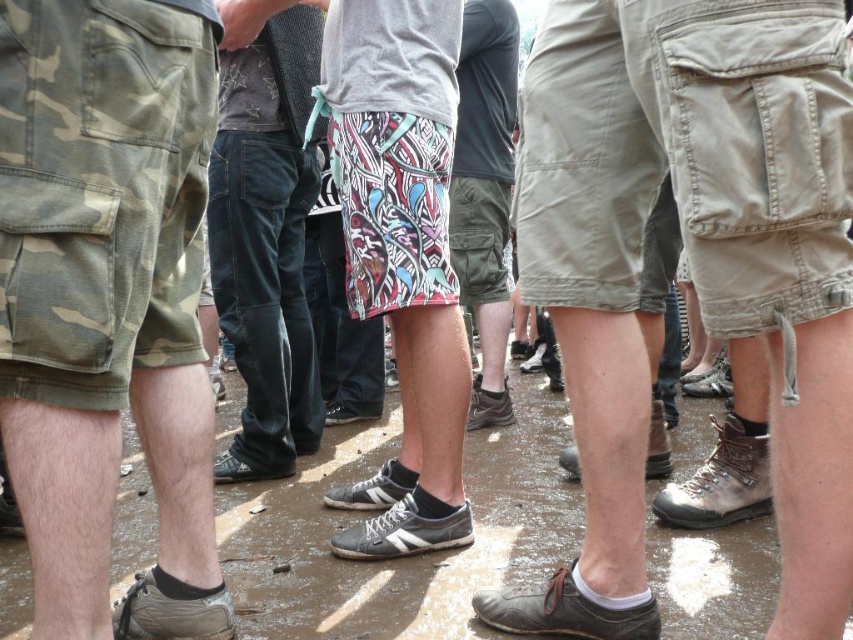
Question: Is multicolored printed shorts at center below camo-patterned shorts at center?

Choices:
 (A) yes
 (B) no

Answer: (A)

Question: Which object is the closest to the camo-patterned shorts at center?

Choices:
 (A) multicolored printed shorts at center
 (B) camo fabric shorts at left
 (C) denim jeans at center

Answer: (C)

Question: Which object appears farthest from the camera in this image?

Choices:
 (A) denim jeans at center
 (B) camo-patterned shorts at center
 (C) khaki cotton shorts at right
 (D) multicolored printed shorts at center

Answer: (B)

Question: From the image, what is the correct spatial relationship of khaki cotton shorts at right in relation to camo-patterned shorts at center?

Choices:
 (A) below
 (B) above

Answer: (A)

Question: Does denim jeans at center appear on the left side of multicolored printed shorts at center?

Choices:
 (A) no
 (B) yes

Answer: (B)

Question: Estimate the real-world distances between objects in this image. Which object is closer to the camo fabric shorts at left?

Choices:
 (A) denim jeans at center
 (B) camo-patterned shorts at center
 (C) multicolored printed shorts at center
 (D) khaki cotton shorts at right

Answer: (C)